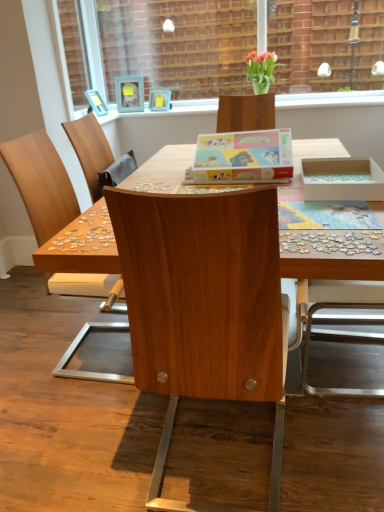
Question: Is wooden chair at center not close to wooden desk at center?

Choices:
 (A) yes
 (B) no

Answer: (B)

Question: Considering the relative positions of wooden chair at center and wooden desk at center in the image provided, is wooden chair at center behind wooden desk at center?

Choices:
 (A) yes
 (B) no

Answer: (A)

Question: From the image's perspective, is wooden chair at center under wooden desk at center?

Choices:
 (A) yes
 (B) no

Answer: (A)

Question: Is the surface of wooden chair at center in direct contact with wooden desk at center?

Choices:
 (A) yes
 (B) no

Answer: (B)

Question: From the image's perspective, is wooden chair at center over wooden desk at center?

Choices:
 (A) yes
 (B) no

Answer: (B)

Question: Could you tell me if wooden chair at center is facing wooden desk at center?

Choices:
 (A) yes
 (B) no

Answer: (A)

Question: Is wooden frame at upper center thinner than translucent glass vase at upper center?

Choices:
 (A) yes
 (B) no

Answer: (A)

Question: Is wooden frame at upper center not within translucent glass vase at upper center?

Choices:
 (A) no
 (B) yes

Answer: (B)

Question: Are wooden frame at upper center and translucent glass vase at upper center making contact?

Choices:
 (A) no
 (B) yes

Answer: (A)

Question: From a real-world perspective, is wooden frame at upper center over translucent glass vase at upper center?

Choices:
 (A) yes
 (B) no

Answer: (B)

Question: Is wooden frame at upper center to the left of translucent glass vase at upper center from the viewer's perspective?

Choices:
 (A) yes
 (B) no

Answer: (A)

Question: Does wooden frame at upper center have a smaller size compared to translucent glass vase at upper center?

Choices:
 (A) no
 (B) yes

Answer: (A)

Question: Considering the relative sizes of multicolored plastic puzzle pieces at right and wooden desk at center in the image provided, is multicolored plastic puzzle pieces at right bigger than wooden desk at center?

Choices:
 (A) yes
 (B) no

Answer: (B)